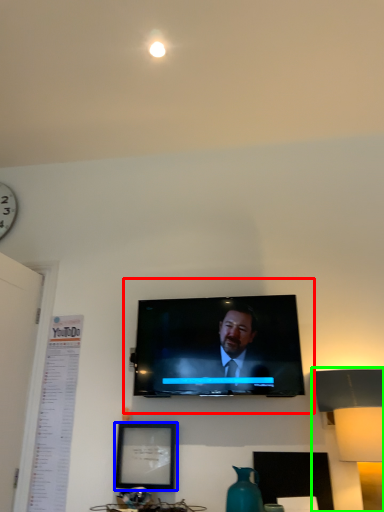
Question: Considering the real-world distances, which object is farthest from tv show (highlighted by a red box)? picture frame (highlighted by a blue box) or table lamp (highlighted by a green box)?

Choices:
 (A) picture frame
 (B) table lamp

Answer: (B)